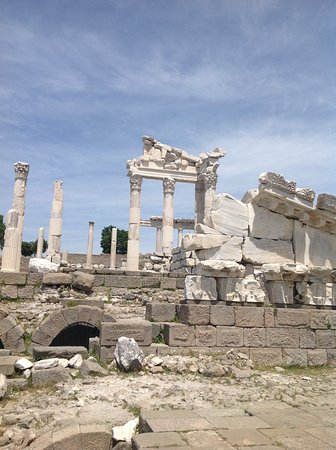
At what (x,y) coordinates should I click in order to perform the action: click on rounded entry way. Please return your answer as a coordinate pair (x, y). This screenshot has height=450, width=336. Looking at the image, I should click on (81, 318).